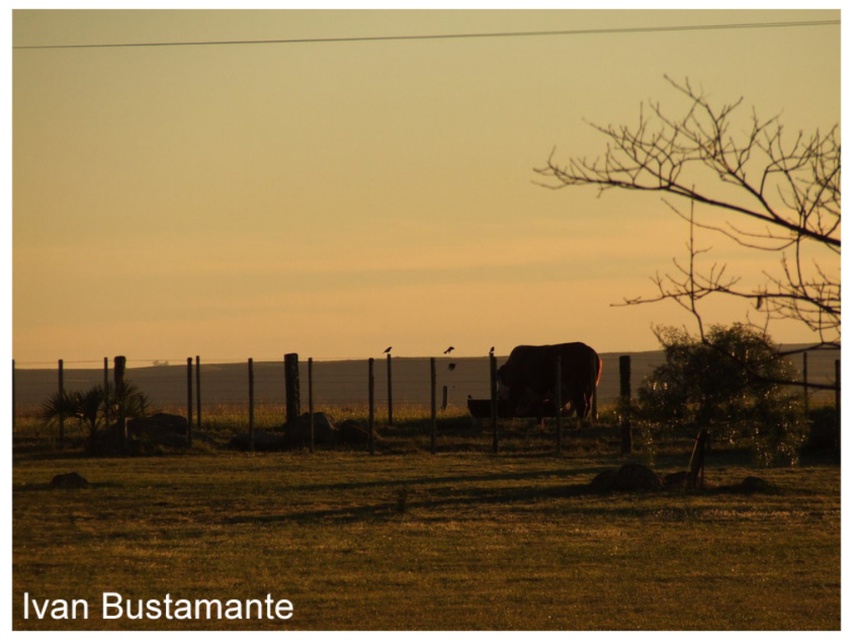
Which is below, metallic wire fence at center or brown matte bull at center?

metallic wire fence at center is below.

Does point (275, 376) come closer to viewer compared to point (537, 401)?

No, it is behind (537, 401).

The height and width of the screenshot is (640, 854). I want to click on metallic wire fence at center, so click(x=340, y=385).

I want to click on metallic wire fence at center, so click(x=340, y=385).

Looking at this image, who is more forward, (x=651, y=400) or (x=527, y=394)?

Point (x=651, y=400)

Does green leafy tree at right lie behind brown matte bull at center?

No.

Image resolution: width=854 pixels, height=640 pixels. What are the coordinates of `green leafy tree at right` in the screenshot? It's located at (724, 390).

Can you confirm if brown bare branches at upper right is taller than brown matte bull at center?

Correct, brown bare branches at upper right is much taller as brown matte bull at center.

Can you confirm if brown bare branches at upper right is smaller than brown matte bull at center?

Actually, brown bare branches at upper right might be larger than brown matte bull at center.

Between point (677, 268) and point (504, 372), which one is positioned in front?

Point (504, 372) is in front.

The image size is (854, 640). What are the coordinates of `brown bare branches at upper right` in the screenshot? It's located at 730,202.